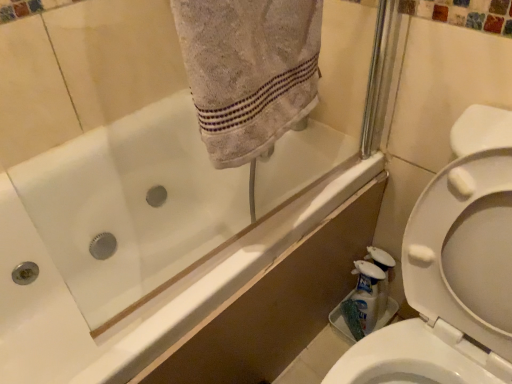
Question: Can you confirm if white glossy bathtub at upper left is positioned to the left of white glossy bottle at lower right, which is the 1th cleaning product from right to left?

Choices:
 (A) yes
 (B) no

Answer: (A)

Question: From the image's perspective, does white glossy bathtub at upper left appear lower than white glossy bottle at lower right, which is the 1th cleaning product from right to left?

Choices:
 (A) yes
 (B) no

Answer: (B)

Question: Is white glossy bathtub at upper left positioned before white glossy bottle at lower right, which is the 1th cleaning product from right to left?

Choices:
 (A) yes
 (B) no

Answer: (A)

Question: Is white glossy bathtub at upper left wider than white glossy bottle at lower right, the 2th cleaning product in the left-to-right sequence?

Choices:
 (A) yes
 (B) no

Answer: (A)

Question: Is white glossy bathtub at upper left outside of white glossy bottle at lower right, which is the 1th cleaning product from right to left?

Choices:
 (A) yes
 (B) no

Answer: (A)

Question: From a real-world perspective, is white glossy bathtub at upper left located higher than white glossy bottle at lower right, the 2th cleaning product in the left-to-right sequence?

Choices:
 (A) yes
 (B) no

Answer: (A)

Question: Considering the relative sizes of white glossy bathtub at upper left and gray cotton towel at upper center in the image provided, is white glossy bathtub at upper left shorter than gray cotton towel at upper center?

Choices:
 (A) no
 (B) yes

Answer: (A)

Question: From the image's perspective, would you say white glossy bathtub at upper left is positioned over gray cotton towel at upper center?

Choices:
 (A) no
 (B) yes

Answer: (A)

Question: From a real-world perspective, is white glossy bathtub at upper left located beneath gray cotton towel at upper center?

Choices:
 (A) yes
 (B) no

Answer: (A)

Question: Does white glossy bathtub at upper left contain gray cotton towel at upper center?

Choices:
 (A) yes
 (B) no

Answer: (B)

Question: Does white glossy bathtub at upper left come behind gray cotton towel at upper center?

Choices:
 (A) yes
 (B) no

Answer: (B)

Question: Considering the relative sizes of white glossy bathtub at upper left and gray cotton towel at upper center in the image provided, is white glossy bathtub at upper left wider than gray cotton towel at upper center?

Choices:
 (A) no
 (B) yes

Answer: (A)

Question: Is white glossy bottle at lower right, which is the 1th cleaning product from right to left, not near white glossy bathtub at upper left?

Choices:
 (A) yes
 (B) no

Answer: (B)